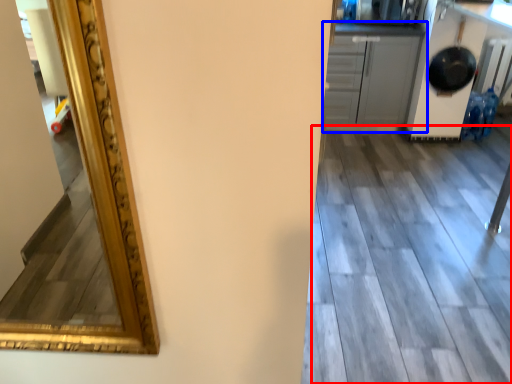
Question: Which of the following is the farthest to the observer, tile (highlighted by a red box) or cabinetry (highlighted by a blue box)?

Choices:
 (A) tile
 (B) cabinetry

Answer: (B)